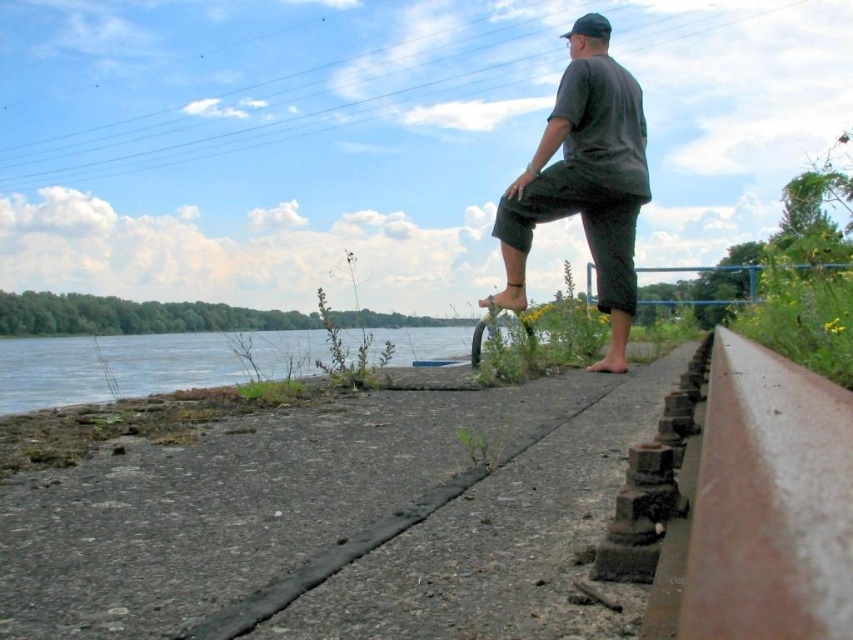
You are a pedestrian trying to cross the gray concrete pavement at center. There is a dark gray fabric pants at center blocking your path. Can you walk around it without stepping off the pavement?

The gray concrete pavement at center has a smaller size compared to dark gray fabric pants at center, so it is likely that the pavement is narrower than the pants, making it difficult to walk around without stepping off.

From the picture: You are a surveyor measuring the coordinates of the gray concrete pavement at center. What are its coordinates?

The gray concrete pavement at center is located at coordinates point (340, 520).